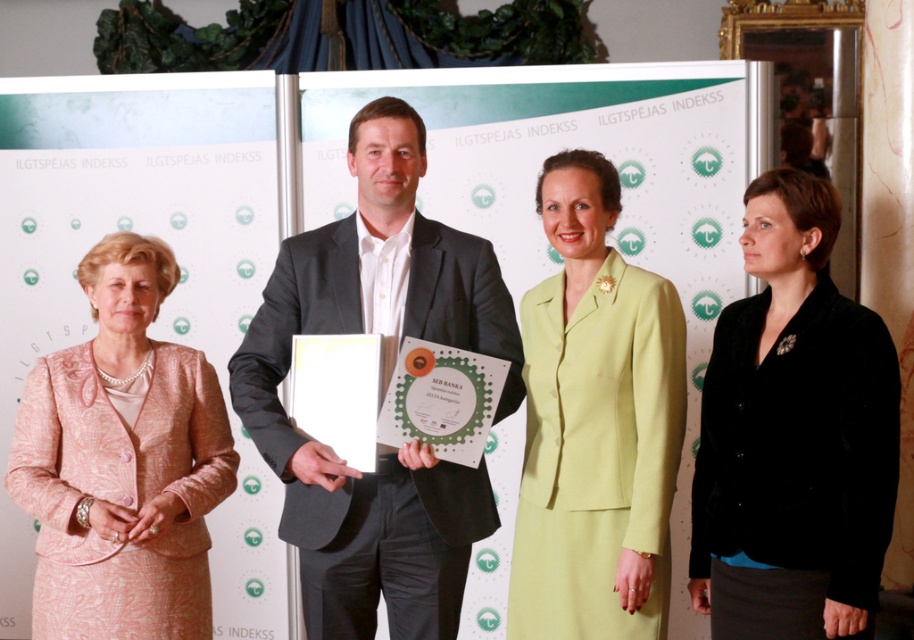
Who is taller, black velvet blazer at right or pink textured suit at left?

With more height is black velvet blazer at right.

Measure the distance between black velvet blazer at right and camera.

black velvet blazer at right and camera are 2.73 meters apart from each other.

What do you see at coordinates (793, 435) in the screenshot? Image resolution: width=914 pixels, height=640 pixels. I see `black velvet blazer at right` at bounding box center [793, 435].

Where is `black velvet blazer at right`? This screenshot has height=640, width=914. black velvet blazer at right is located at coordinates 793,435.

Is point (570, 189) positioned before point (126, 264)?

Yes, point (570, 189) is in front of point (126, 264).

Does point (647, 401) lie behind point (184, 496)?

No, it is in front of (184, 496).

This screenshot has height=640, width=914. In order to click on lime green fabric suit at center in this screenshot , I will do tap(594, 424).

Looking at this image, between black velvet blazer at right and lime green fabric suit at center, which one has more height?

Standing taller between the two is lime green fabric suit at center.

Between black velvet blazer at right and lime green fabric suit at center, which one appears on the right side from the viewer's perspective?

black velvet blazer at right

Is point (753, 506) behind point (582, 308)?

No.

The width and height of the screenshot is (914, 640). Find the location of `black velvet blazer at right`. black velvet blazer at right is located at coordinates (793, 435).